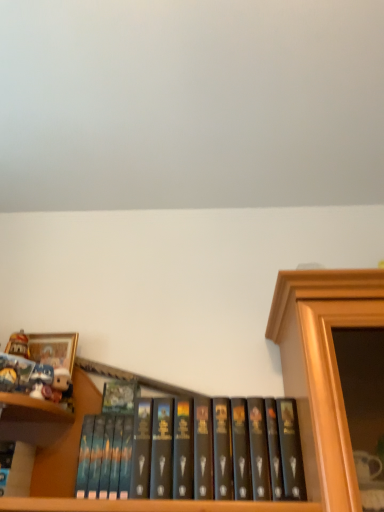
Question: Does gold-framed picture at upper left turn towards matte white plush toy at upper left?

Choices:
 (A) no
 (B) yes

Answer: (A)

Question: Is gold-framed picture at upper left oriented away from matte white plush toy at upper left?

Choices:
 (A) yes
 (B) no

Answer: (B)

Question: Is matte white plush toy at upper left located within gold-framed picture at upper left?

Choices:
 (A) yes
 (B) no

Answer: (B)

Question: Does gold-framed picture at upper left appear on the left side of matte white plush toy at upper left?

Choices:
 (A) no
 (B) yes

Answer: (B)

Question: Does gold-framed picture at upper left have a greater height compared to matte white plush toy at upper left?

Choices:
 (A) no
 (B) yes

Answer: (B)

Question: Is hardcover book at left, placed as the 2th book when sorted from bottom to top, wider or thinner than black matte book at center, which is the 2th book from top to bottom?

Choices:
 (A) thin
 (B) wide

Answer: (A)

Question: Would you say hardcover book at left, placed as the 2th book when sorted from bottom to top, is to the left or to the right of black matte book at center, the 1th book from the bottom, in the picture?

Choices:
 (A) right
 (B) left

Answer: (B)

Question: In the image, is hardcover book at left, which is counted as the second book, starting from the right, positioned in front of or behind black matte book at center, which ranks as the first book in right-to-left order?

Choices:
 (A) front
 (B) behind

Answer: (B)

Question: From the image's perspective, relative to black matte book at center, the 1th book from the bottom, is hardcover book at left, marked as the 1th book in a top-to-bottom arrangement, above or below?

Choices:
 (A) above
 (B) below

Answer: (A)

Question: Based on their positions, is black matte book at center, arranged as the 2th book when viewed from the left, located to the left or right of gold-framed picture at upper left?

Choices:
 (A) right
 (B) left

Answer: (A)

Question: From the image's perspective, is black matte book at center, which is the 2th book from top to bottom, above or below gold-framed picture at upper left?

Choices:
 (A) above
 (B) below

Answer: (B)

Question: In terms of height, does black matte book at center, which ranks as the first book in right-to-left order, look taller or shorter compared to gold-framed picture at upper left?

Choices:
 (A) short
 (B) tall

Answer: (B)

Question: Considering the positions of point (155, 485) and point (74, 355), is point (155, 485) closer or farther from the camera than point (74, 355)?

Choices:
 (A) closer
 (B) farther

Answer: (A)

Question: Is matte white plush toy at upper left taller or shorter than gold-framed picture at upper left?

Choices:
 (A) tall
 (B) short

Answer: (B)

Question: From the image's perspective, is matte white plush toy at upper left positioned above or below gold-framed picture at upper left?

Choices:
 (A) above
 (B) below

Answer: (B)